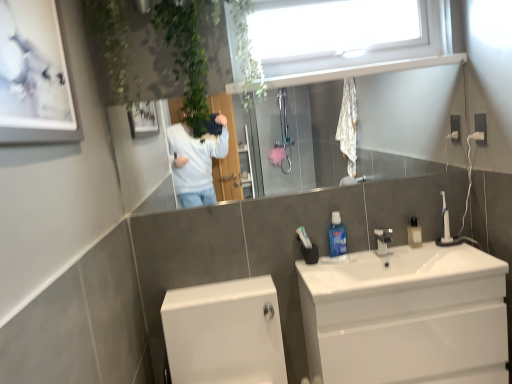
Question: Is white glossy toilet at lower left outside of white glossy sink at center?

Choices:
 (A) no
 (B) yes

Answer: (B)

Question: Can you confirm if white glossy toilet at lower left is shorter than white glossy sink at center?

Choices:
 (A) no
 (B) yes

Answer: (A)

Question: Can you confirm if white glossy toilet at lower left is positioned to the right of white glossy sink at center?

Choices:
 (A) yes
 (B) no

Answer: (B)

Question: Is white glossy toilet at lower left beside white glossy sink at center?

Choices:
 (A) yes
 (B) no

Answer: (B)

Question: Can you confirm if white glossy toilet at lower left is taller than white glossy sink at center?

Choices:
 (A) yes
 (B) no

Answer: (A)

Question: Would you consider white glossy toilet at lower left to be distant from white glossy sink at center?

Choices:
 (A) yes
 (B) no

Answer: (B)

Question: Is white glossy sink at center completely or partially outside of white glossy picture frame at upper left?

Choices:
 (A) no
 (B) yes

Answer: (B)

Question: Is white glossy sink at center positioned in front of white glossy picture frame at upper left?

Choices:
 (A) yes
 (B) no

Answer: (B)

Question: From the image's perspective, is white glossy sink at center located above white glossy picture frame at upper left?

Choices:
 (A) yes
 (B) no

Answer: (B)

Question: Does white glossy sink at center have a lesser height compared to white glossy picture frame at upper left?

Choices:
 (A) yes
 (B) no

Answer: (A)

Question: Is white glossy sink at center oriented towards white glossy picture frame at upper left?

Choices:
 (A) yes
 (B) no

Answer: (B)

Question: Is white glossy sink at center looking in the opposite direction of white glossy picture frame at upper left?

Choices:
 (A) yes
 (B) no

Answer: (B)

Question: Is white glossy picture frame at upper left further to the viewer compared to white glossy sink at center?

Choices:
 (A) yes
 (B) no

Answer: (B)